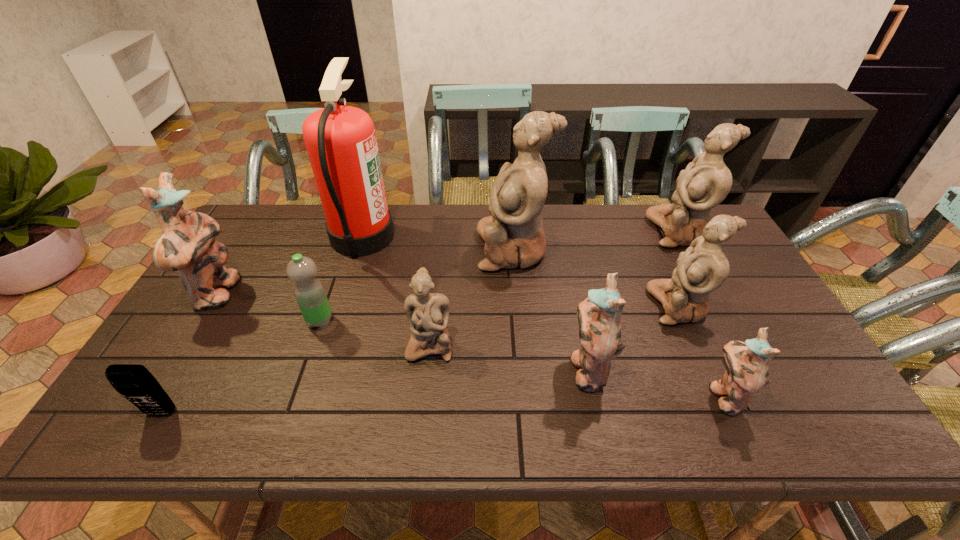
You are a GUI agent. You are given a task and a screenshot of the screen. Output one action in this format:
    pyautogui.click(x=<x>, y=<y>)
    Task: Click on the pink figurine identified as the third closest to the nearest white figurine
    The height and width of the screenshot is (540, 960).
    Given the screenshot: What is the action you would take?
    pyautogui.click(x=747, y=373)

Image resolution: width=960 pixels, height=540 pixels. What are the coordinates of `vacant area that satisfies the following two spatial constraints: 1. on the front-facing side of the smallest pink figurine; 2. on the screen of the cellular telephone` in the screenshot? It's located at (732, 413).

Locate an element on the screen. The image size is (960, 540). free space that satisfies the following two spatial constraints: 1. on the front-facing side of the second biggest white figurine; 2. on the front-facing side of the nearest white figurine is located at coordinates (741, 345).

At what (x,y) coordinates should I click in order to perform the action: click on vacant point that satisfies the following two spatial constraints: 1. at the nozzle of the fire extinguisher; 2. on the screen of the cellular telephone. Please return your answer as a coordinate pair (x, y). The height and width of the screenshot is (540, 960). Looking at the image, I should click on (306, 413).

The height and width of the screenshot is (540, 960). What are the coordinates of `blank area in the image that satisfies the following two spatial constraints: 1. on the front-facing side of the second biggest pink figurine; 2. on the screen of the cellular telephone` in the screenshot? It's located at (596, 413).